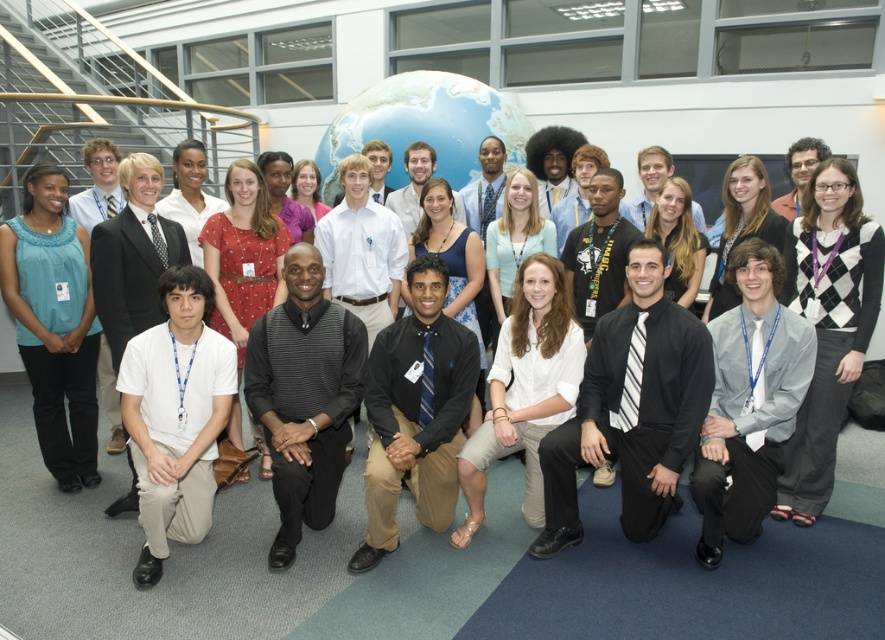
You are a photographer trying to capture a group photo of the team. You notice the black striped sweater at center and the black smooth shirt at center are too close. What is the minimum distance you should move them apart to ensure they are at least 40 centimeters apart?

The current distance between the black striped sweater at center and the black smooth shirt at center is 31.82 centimeters. To achieve the desired 40 centimeters, you need to increase the distance by 8.18 centimeters. Therefore, the minimum additional distance required is approximately 8.2 centimeters.

From the picture: You are organizing a photo shoot and need to ensure that all participants are visible in the frame. Given that the black smooth shirt at center and the matte blue blouse at left are two key elements, which one might require more space due to its size? Please explain based on their sizes.

The black smooth shirt at center is larger in size than the matte blue blouse at left, so it requires more space to ensure it is fully visible in the frame.